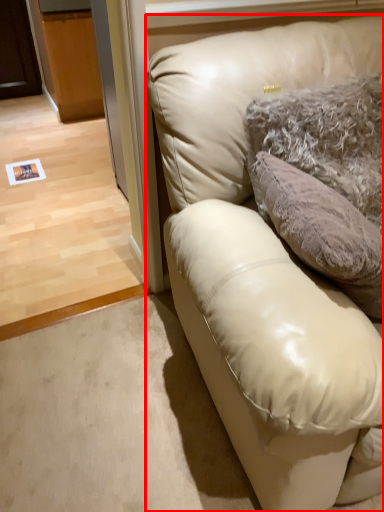
Question: Observing the image, what is the correct spatial positioning of studio couch (annotated by the red box) in reference to pillow?

Choices:
 (A) right
 (B) left

Answer: (A)